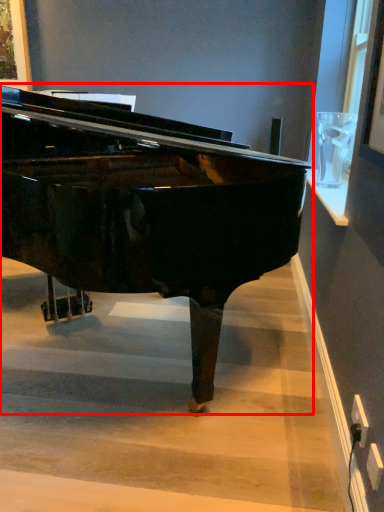
Question: From the image's perspective, considering the relative positions of piano (annotated by the red box) and stairwell in the image provided, where is piano (annotated by the red box) located with respect to the staircase?

Choices:
 (A) above
 (B) below

Answer: (A)